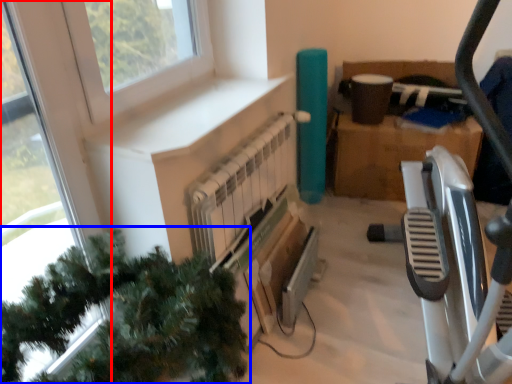
Question: Which object is further to the camera taking this photo, window (highlighted by a red box) or christmas tree (highlighted by a blue box)?

Choices:
 (A) window
 (B) christmas tree

Answer: (A)